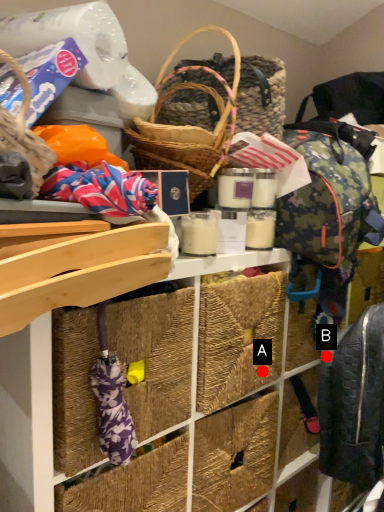
Question: Two points are circled on the image, labeled by A and B beside each circle. Among these points, which one is farthest from the camera?

Choices:
 (A) A is further
 (B) B is further

Answer: (A)